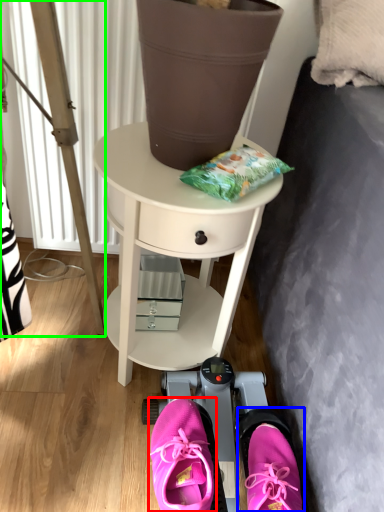
Question: Based on their relative distances, which object is farther from footwear (highlighted by a red box)? Choose from footwear (highlighted by a blue box) and ladder (highlighted by a green box).

Choices:
 (A) footwear
 (B) ladder

Answer: (B)